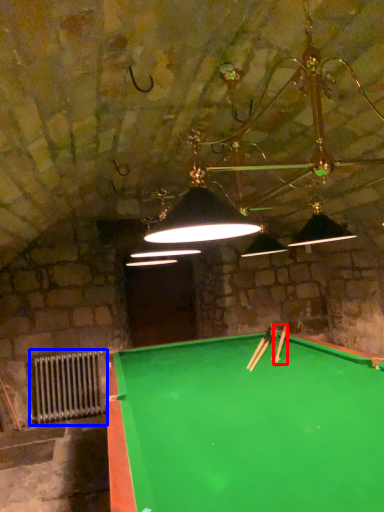
Question: Among these objects, which one is farthest to the camera, cue (highlighted by a red box) or radiator (highlighted by a blue box)?

Choices:
 (A) cue
 (B) radiator

Answer: (B)